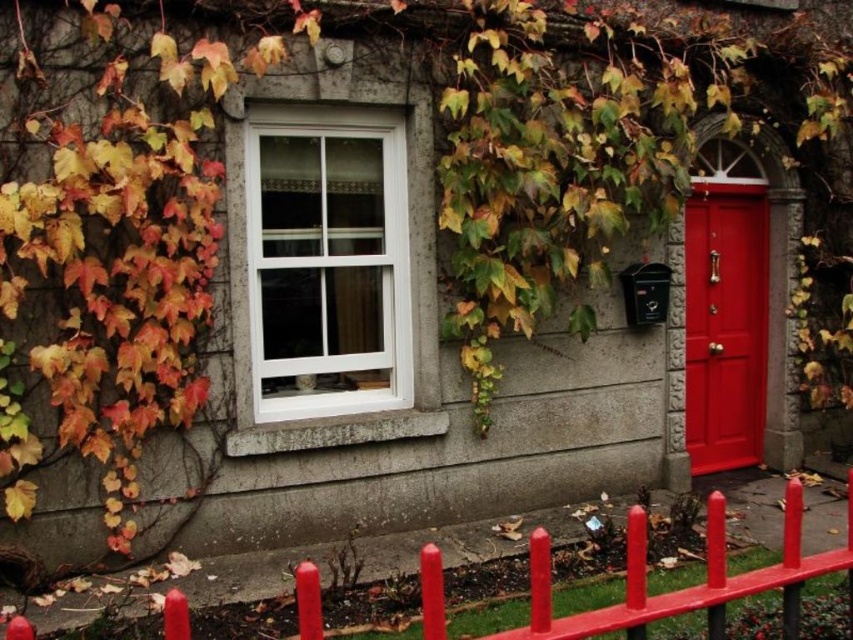
Who is lower down, white plastic window at center or smooth glossy fence at lower center?

smooth glossy fence at lower center

Does white plastic window at center appear on the left side of smooth glossy fence at lower center?

Yes, white plastic window at center is to the left of smooth glossy fence at lower center.

Is point (357, 358) positioned after point (305, 580)?

That is True.

Where is `white plastic window at center`? The height and width of the screenshot is (640, 853). white plastic window at center is located at coordinates (328, 260).

Between smooth glossy fence at lower center and glossy wood door at right, which one has more height?

Standing taller between the two is glossy wood door at right.

Is smooth glossy fence at lower center to the left of glossy wood door at right from the viewer's perspective?

Yes, smooth glossy fence at lower center is to the left of glossy wood door at right.

Between point (724, 596) and point (717, 280), which one is positioned behind?

The point (717, 280) is behind.

The height and width of the screenshot is (640, 853). In order to click on smooth glossy fence at lower center in this screenshot , I will do [x=686, y=588].

Which is behind, point (306, 124) or point (698, 474)?

Positioned behind is point (698, 474).

Between white plastic window at center and glossy wood door at right, which one has less height?

Standing shorter between the two is white plastic window at center.

Which is behind, point (399, 317) or point (706, 374)?

The point (706, 374) is more distant.

Where is `white plastic window at center`? Image resolution: width=853 pixels, height=640 pixels. white plastic window at center is located at coordinates (328, 260).